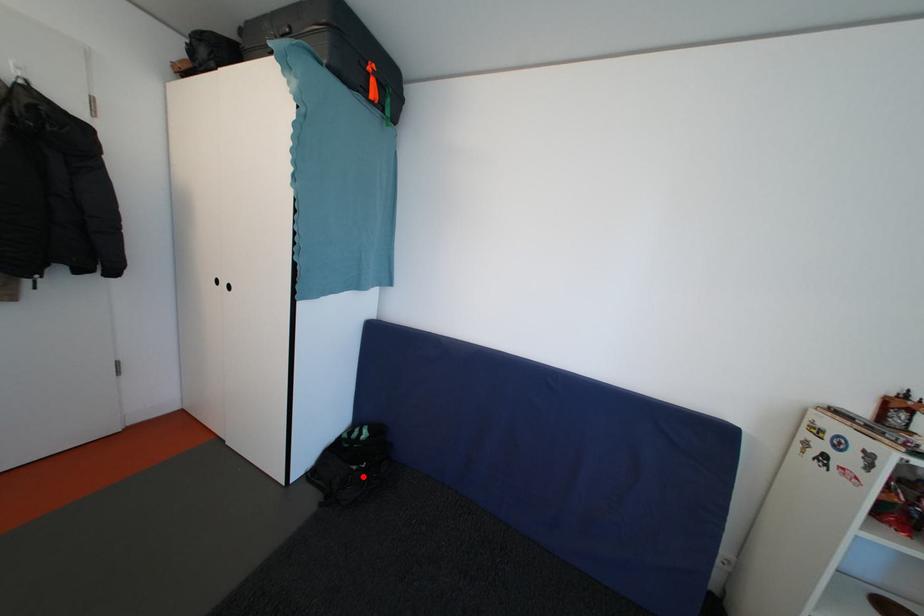
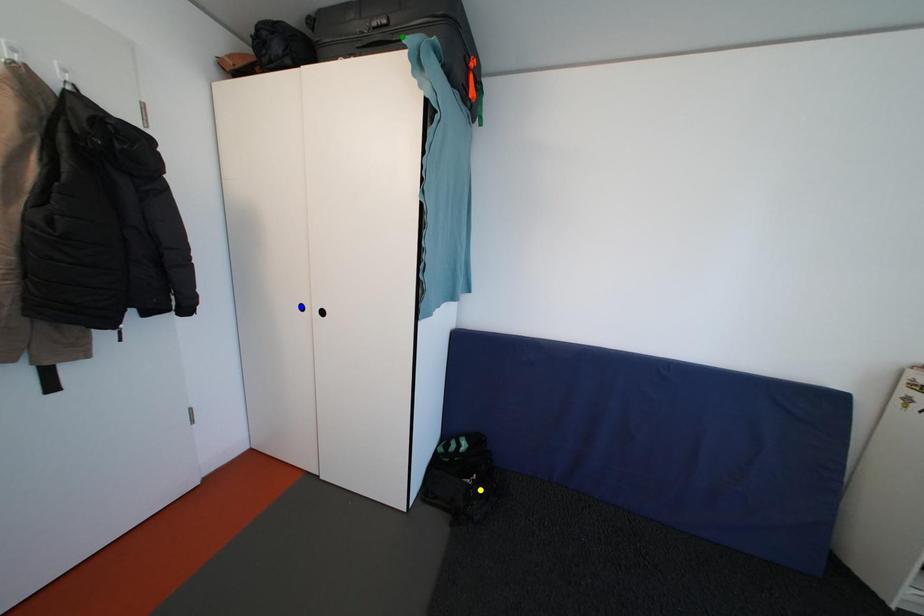
Question: I am providing you with two images of the same scene from different viewpoints. A red point is marked on the first image. You are given multiple points on the second image. Which point in image 2 represents the same 3d spot as the red point in image 1?

Choices:
 (A) yellow point
 (B) green point
 (C) blue point

Answer: (A)